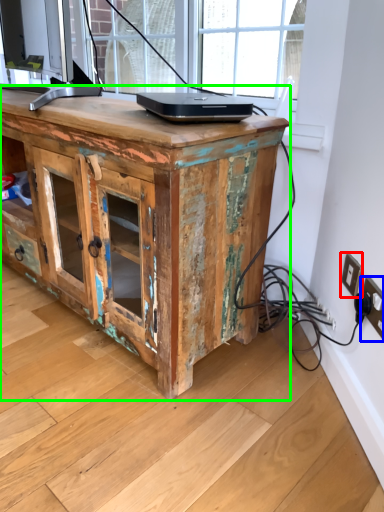
Question: Considering the real-world distances, which object is closest to electric outlet (highlighted by a red box)? electric outlet (highlighted by a blue box) or desk (highlighted by a green box).

Choices:
 (A) electric outlet
 (B) desk

Answer: (A)